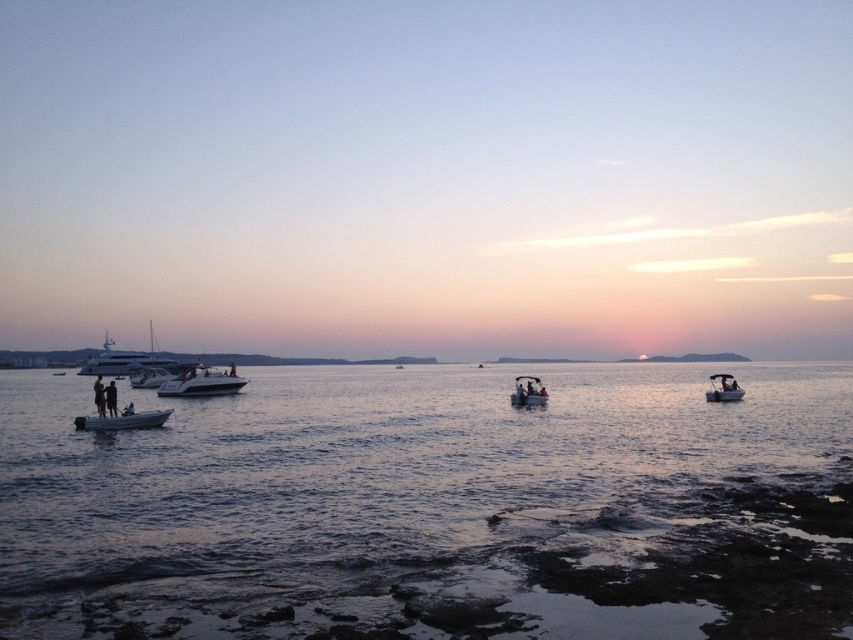
You are a photographer planning to capture the boats in the scene. You want to ensure the white matte boat at lower left and the shiny silver yacht at left are both visible in your shot. Considering their heights, which boat should you position closer to the center of the frame to avoid it being obscured by the other?

Since the white matte boat at lower left is not as tall as the shiny silver yacht at left, you should position the white matte boat at lower left closer to the center of the frame. This way, it won

From the picture: You are a photographer standing on the rocky shoreline. You want to take a photo that includes both the white glossy sailboat at left and the tan skin person at left. Which object should you position closer to the foreground to ensure both are in focus?

The white glossy sailboat at left is taller than the tan skin person at left. To ensure both are in focus, position the tan skin person at left closer to the foreground since the sailboat is taller and might require a wider depth of field.